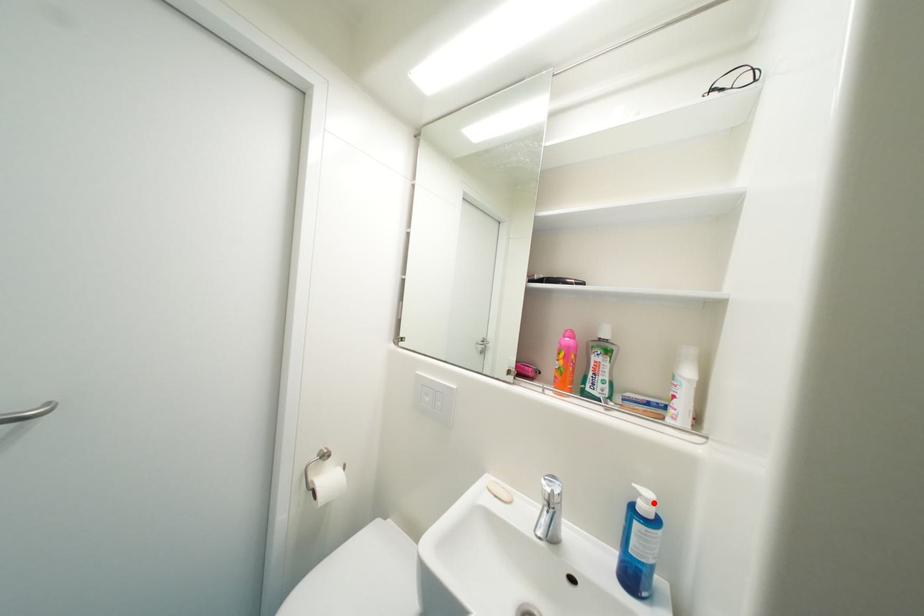
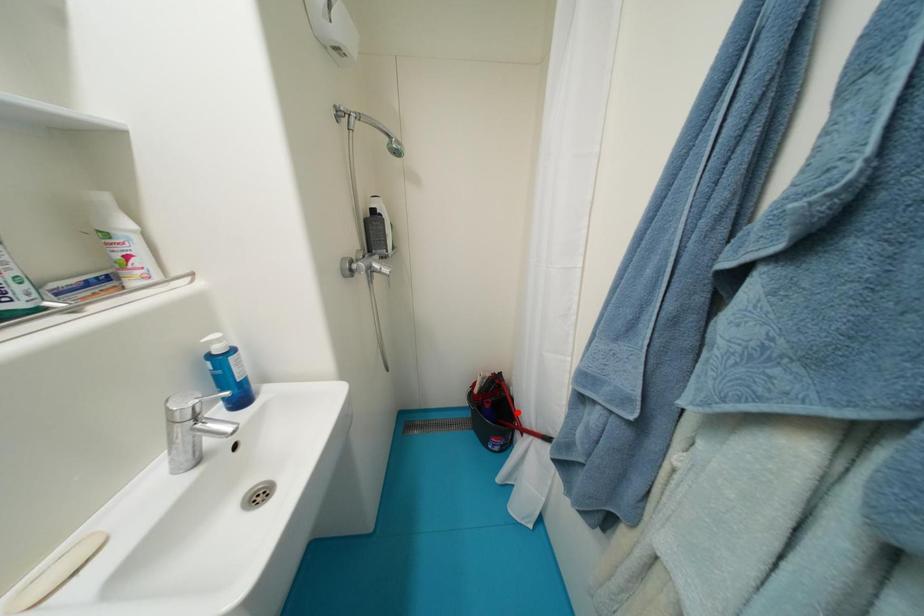
I am providing you with two images of the same scene from different viewpoints. A red point is marked on the first image and another point is marked on the second image. Is the marked point in image1 the same physical position as the marked point in image2?

No